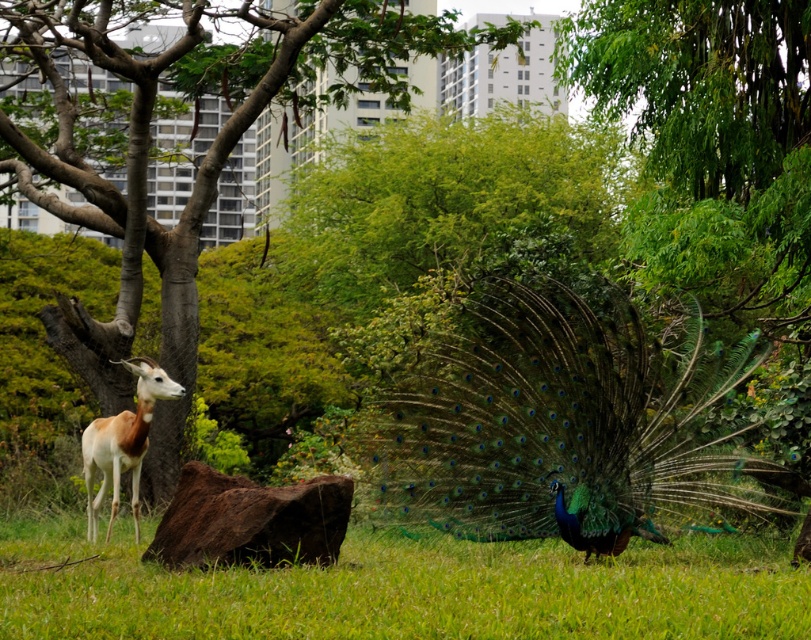
What do you see at coordinates (556, 422) in the screenshot? I see `shiny green peacock at center` at bounding box center [556, 422].

Based on the photo, who is more distant from viewer, [404,403] or [181,408]?

The point [181,408] is behind.

Describe the element at coordinates (556, 422) in the screenshot. I see `shiny green peacock at center` at that location.

This screenshot has width=811, height=640. I want to click on shiny green peacock at center, so click(556, 422).

Is green grassy at lower center positioned at the back of white glossy antelope at left?

That is False.

Does point (736, 570) come closer to viewer compared to point (144, 384)?

That is True.

Which is in front, point (442, 547) or point (182, 392)?

Point (442, 547)

Locate an element on the screen. The width and height of the screenshot is (811, 640). green grassy at lower center is located at coordinates pos(401,588).

Can you confirm if shiny green peacock at center is taller than green grassy at lower center?

Yes, shiny green peacock at center is taller than green grassy at lower center.

Locate an element on the screen. The height and width of the screenshot is (640, 811). shiny green peacock at center is located at coordinates (556, 422).